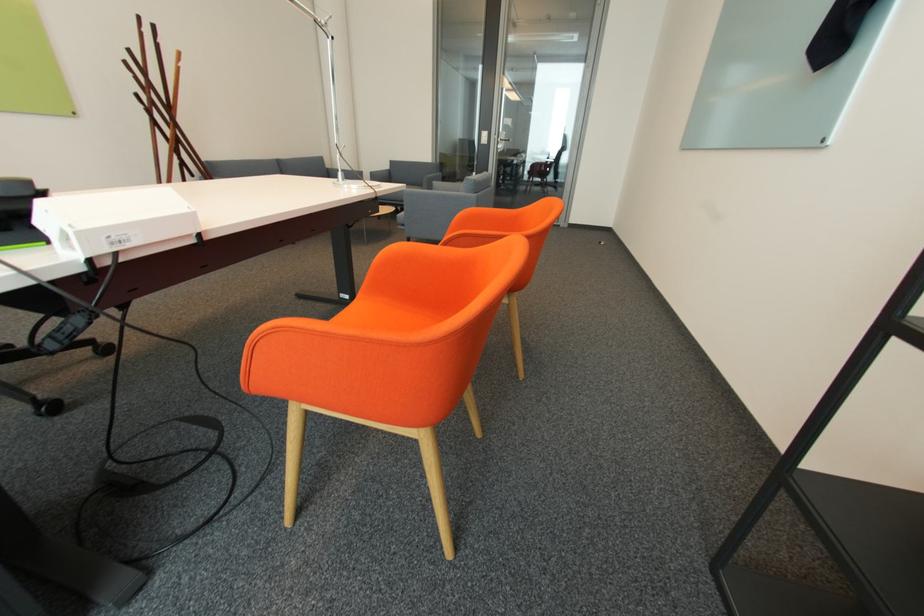
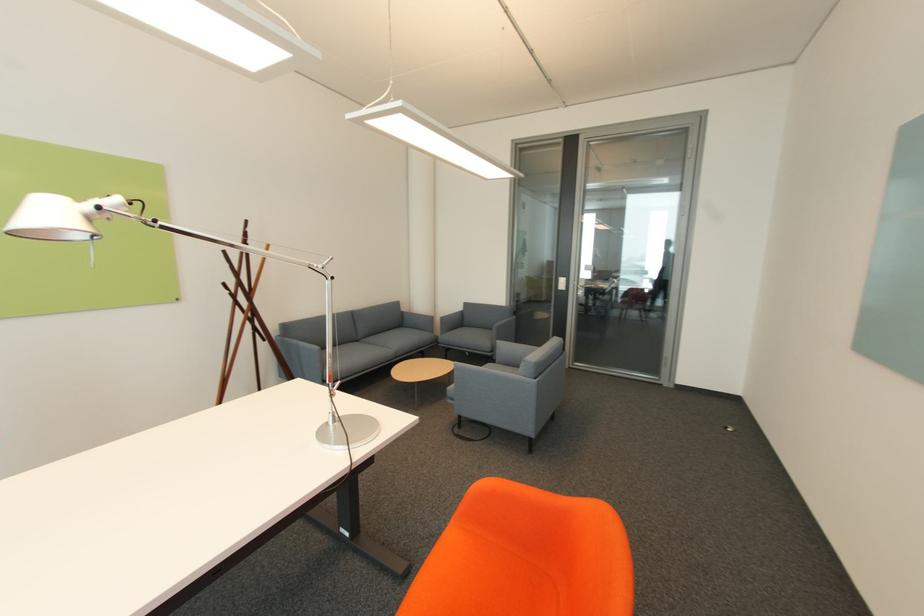
Which direction would the cameraman need to move to produce the second image?

The cameraman walked toward right, forward.